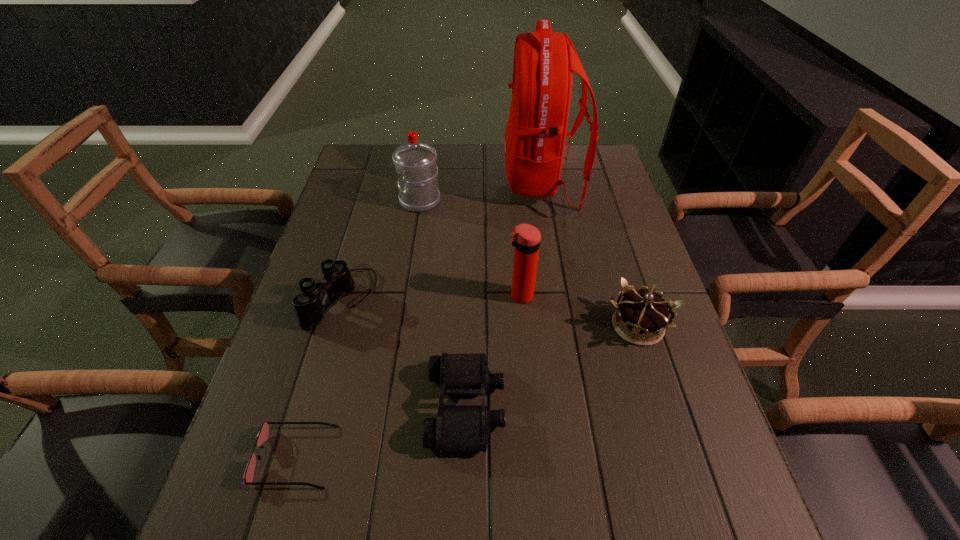
I want to click on backpack, so click(x=544, y=61).

Where is `the fifth object from right to left`? The height and width of the screenshot is (540, 960). the fifth object from right to left is located at coordinates (415, 162).

Where is `thermos bottle`? thermos bottle is located at coordinates (526, 238).

Find the location of a particular element. Image resolution: width=960 pixels, height=540 pixels. the taller binoculars is located at coordinates (338, 282).

At what (x,y) coordinates should I click in order to perform the action: click on the left binoculars. Please return your answer as a coordinate pair (x, y). This screenshot has height=540, width=960. Looking at the image, I should click on (338, 282).

The height and width of the screenshot is (540, 960). In order to click on crown in this screenshot , I will do [x=640, y=314].

At what (x,y) coordinates should I click in order to perform the action: click on the right binoculars. Please return your answer as a coordinate pair (x, y). The width and height of the screenshot is (960, 540). Looking at the image, I should click on pyautogui.click(x=457, y=427).

This screenshot has width=960, height=540. Identify the location of the sixth tallest object. (457, 427).

Where is `the shortest object`? the shortest object is located at coordinates (262, 436).

Where is `free space located 0.200m on the main compartment of the backpack`? The width and height of the screenshot is (960, 540). free space located 0.200m on the main compartment of the backpack is located at coordinates (442, 183).